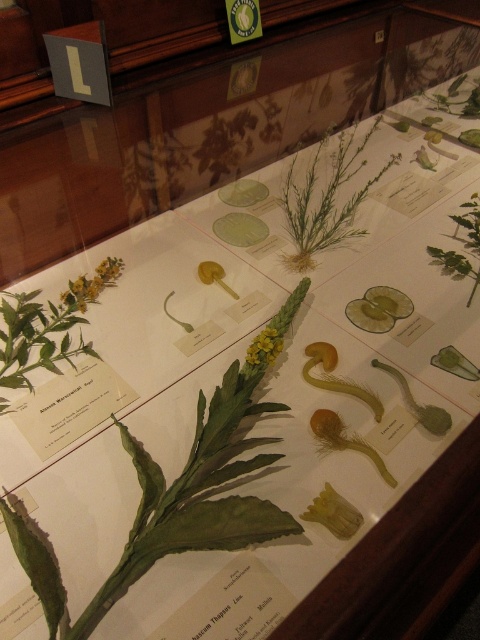
Who is positioned more to the right, green matte plant at center or yellow matte flower at upper left?

From the viewer's perspective, green matte plant at center appears more on the right side.

What do you see at coordinates (325, 196) in the screenshot? I see `green matte plant at center` at bounding box center [325, 196].

The image size is (480, 640). Find the location of `green matte plant at center`. green matte plant at center is located at coordinates (325, 196).

Who is taller, green matte leaf at center or yellow matte flower at upper left?

green matte leaf at center is taller.

Can you confirm if green matte leaf at center is shorter than yellow matte flower at upper left?

In fact, green matte leaf at center may be taller than yellow matte flower at upper left.

Which is behind, point (455, 237) or point (84, 291)?

The point (455, 237) is behind.

Find the location of a particular element. green matte leaf at center is located at coordinates (455, 266).

Consider the image. Is green matte plant at center bigger than yellow matte flower at center?

Indeed, green matte plant at center has a larger size compared to yellow matte flower at center.

Can you confirm if green matte plant at center is thinner than yellow matte flower at center?

No.

Locate an element on the screen. Image resolution: width=480 pixels, height=640 pixels. green matte plant at center is located at coordinates (325, 196).

Locate an element on the screen. The height and width of the screenshot is (640, 480). green matte plant at center is located at coordinates (325, 196).